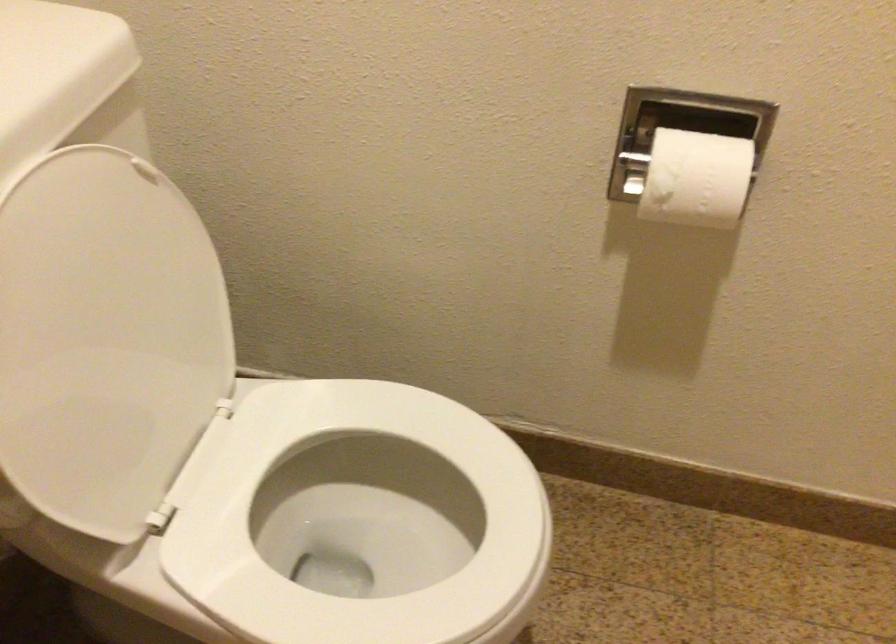
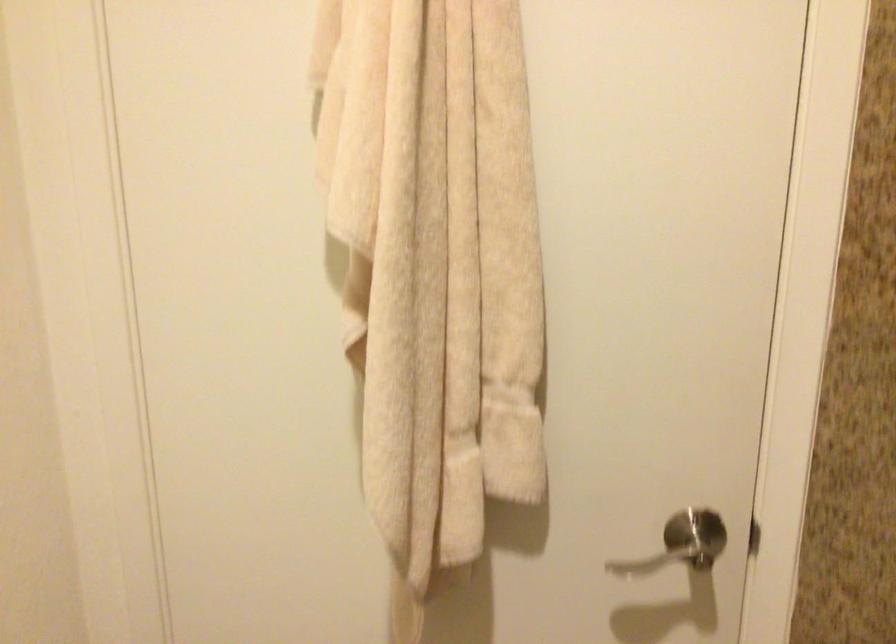
Question: The camera is either moving clockwise (left) or counter-clockwise (right) around the object. The first image is from the beginning of the video and the second image is from the end. Is the camera moving left or right when shooting the video?

Choices:
 (A) Left
 (B) Right

Answer: (A)